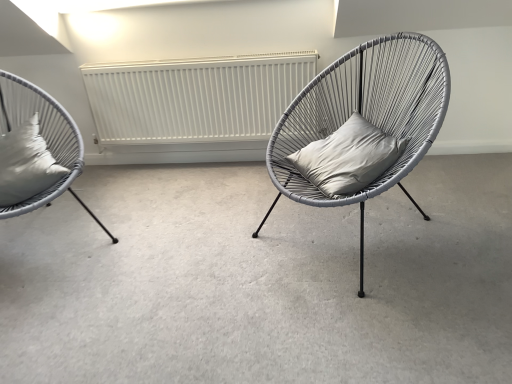
Question: Considering the relative sizes of white matte radiator at center and matte gray wicker chair at left, which is the 2th chair from right to left, in the image provided, is white matte radiator at center taller than matte gray wicker chair at left, which is the 2th chair from right to left,?

Choices:
 (A) yes
 (B) no

Answer: (B)

Question: Is white matte radiator at center to the left of matte gray wicker chair at left, which is the 2th chair from right to left, from the viewer's perspective?

Choices:
 (A) no
 (B) yes

Answer: (A)

Question: Is white matte radiator at center surrounding matte gray wicker chair at left, which is counted as the first chair, starting from the left?

Choices:
 (A) no
 (B) yes

Answer: (A)

Question: Does white matte radiator at center appear on the right side of matte gray wicker chair at left, which is counted as the first chair, starting from the left?

Choices:
 (A) yes
 (B) no

Answer: (A)

Question: From a real-world perspective, is white matte radiator at center on top of matte gray wicker chair at left, which is counted as the first chair, starting from the left?

Choices:
 (A) yes
 (B) no

Answer: (B)

Question: Does white matte radiator at center have a lesser width compared to matte gray wicker chair at left, which is the 2th chair from right to left?

Choices:
 (A) no
 (B) yes

Answer: (B)

Question: Does white matte radiator at center have a lesser width compared to gray matte cushion at center?

Choices:
 (A) no
 (B) yes

Answer: (B)

Question: Is white matte radiator at center oriented towards gray matte cushion at center?

Choices:
 (A) no
 (B) yes

Answer: (B)

Question: Is white matte radiator at center closer to camera compared to gray matte cushion at center?

Choices:
 (A) no
 (B) yes

Answer: (A)

Question: Does white matte radiator at center appear on the right side of gray matte cushion at center?

Choices:
 (A) yes
 (B) no

Answer: (B)

Question: From a real-world perspective, is white matte radiator at center under gray matte cushion at center?

Choices:
 (A) no
 (B) yes

Answer: (A)

Question: Is the depth of white matte radiator at center greater than that of gray matte cushion at center?

Choices:
 (A) no
 (B) yes

Answer: (B)

Question: Is matte gray wicker chair at center, placed as the 2th chair when sorted from left to right, at the right side of matte gray wicker chair at left, which is counted as the first chair, starting from the left?

Choices:
 (A) yes
 (B) no

Answer: (A)